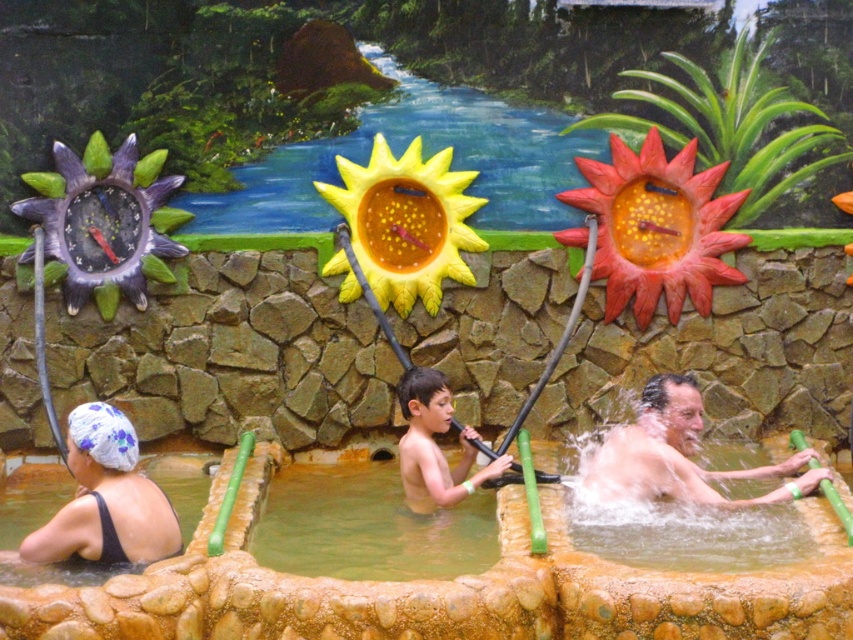
You are standing at the entrance of the water park and see the smooth stone hot tub at center. Can you estimate its position relative to the entrance?

The smooth stone hot tub at center is located at point 0.922 on the x axis and 0.519 on the y axis relative to the entrance.

You are a visitor at the water park and want to know if the smooth green pole at lower right can be used to reach the top of the light brown skin at center. Can it?

The smooth green pole at lower right is not as tall as light brown skin at center, so it cannot reach the top of the light brown skin at center.

You are a visitor at the water park and want to place a small decorative item between the blue printed fabric at lower left and the smooth green pole at lower right. Based on their sizes, which object should you place closer to the smaller one to ensure the item fits well?

The blue printed fabric at lower left occupies less space than the smooth green pole at lower right, so you should place the decorative item closer to the blue printed fabric at lower left to ensure it fits well.